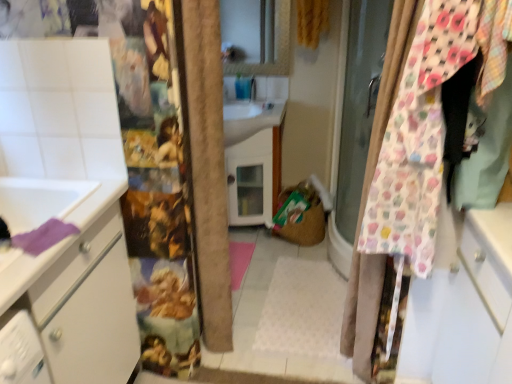
Question: From a real-world perspective, is yellow textured curtain at upper center, the first curtain viewed from the back, positioned under floral fabric curtain at right, the second curtain when ordered from back to front, based on gravity?

Choices:
 (A) no
 (B) yes

Answer: (A)

Question: From a real-world perspective, is yellow textured curtain at upper center, which appears as the 2th curtain when viewed from the front, located higher than floral fabric curtain at right, placed as the first curtain when sorted from bottom to top?

Choices:
 (A) yes
 (B) no

Answer: (A)

Question: Can you confirm if yellow textured curtain at upper center, the first curtain viewed from the back, is taller than floral fabric curtain at right, the first curtain from the front?

Choices:
 (A) yes
 (B) no

Answer: (B)

Question: From the image's perspective, is yellow textured curtain at upper center, the first curtain viewed from the back, on floral fabric curtain at right, marked as the second curtain in a top-to-bottom arrangement?

Choices:
 (A) no
 (B) yes

Answer: (B)

Question: Would you say yellow textured curtain at upper center, the first curtain viewed from the back, is outside floral fabric curtain at right, placed as the first curtain when sorted from bottom to top?

Choices:
 (A) yes
 (B) no

Answer: (A)

Question: Considering the relative sizes of yellow textured curtain at upper center, the 1th curtain when ordered from top to bottom, and floral fabric curtain at right, the first curtain from the front, in the image provided, is yellow textured curtain at upper center, the 1th curtain when ordered from top to bottom, bigger than floral fabric curtain at right, the first curtain from the front,?

Choices:
 (A) yes
 (B) no

Answer: (B)

Question: Is yellow textured curtain at upper center, the 1th curtain when ordered from top to bottom, next to white glossy sink at center?

Choices:
 (A) no
 (B) yes

Answer: (A)

Question: Is yellow textured curtain at upper center, which appears as the 2th curtain when viewed from the front, further to the viewer compared to white glossy sink at center?

Choices:
 (A) no
 (B) yes

Answer: (A)

Question: From a real-world perspective, is yellow textured curtain at upper center, which appears as the 2th curtain when viewed from the front, below white glossy sink at center?

Choices:
 (A) no
 (B) yes

Answer: (A)

Question: From the image's perspective, is yellow textured curtain at upper center, the first curtain viewed from the back, beneath white glossy sink at center?

Choices:
 (A) yes
 (B) no

Answer: (B)

Question: Is yellow textured curtain at upper center, the first curtain viewed from the back, closer to camera compared to white glossy sink at center?

Choices:
 (A) no
 (B) yes

Answer: (B)

Question: Considering the relative sizes of yellow textured curtain at upper center, the 1th curtain when ordered from top to bottom, and white glossy sink at center in the image provided, is yellow textured curtain at upper center, the 1th curtain when ordered from top to bottom, thinner than white glossy sink at center?

Choices:
 (A) yes
 (B) no

Answer: (A)

Question: Considering the relative sizes of floral fabric curtain at right, the first curtain from the front, and white glossy sink at center in the image provided, is floral fabric curtain at right, the first curtain from the front, taller than white glossy sink at center?

Choices:
 (A) no
 (B) yes

Answer: (B)